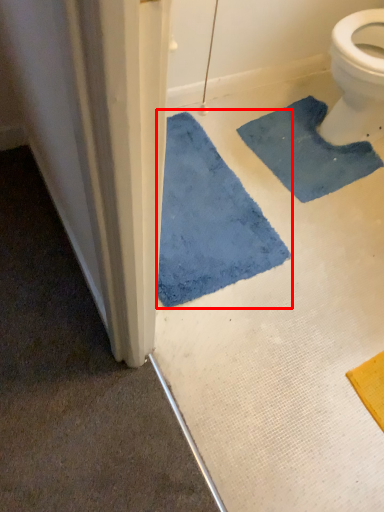
Question: From the image's perspective, what is the correct spatial positioning of bath mat (annotated by the red box) in reference to bath mat?

Choices:
 (A) below
 (B) above

Answer: (A)